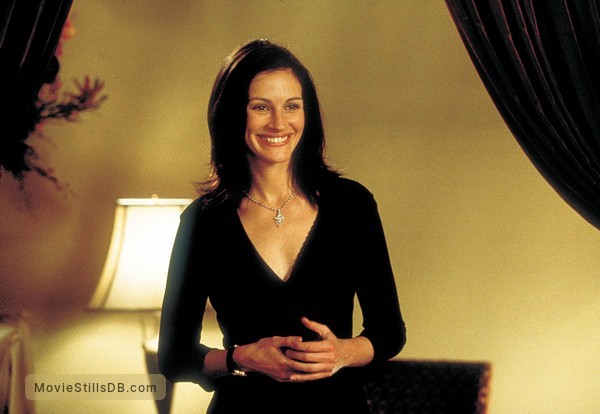
Identify the location of tan wall. The image size is (600, 414). (425, 134).